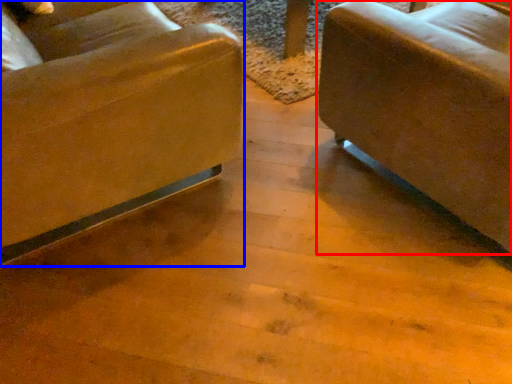
Question: Which of the following is the farthest to the observer, studio couch (highlighted by a red box) or chair (highlighted by a blue box)?

Choices:
 (A) studio couch
 (B) chair

Answer: (A)